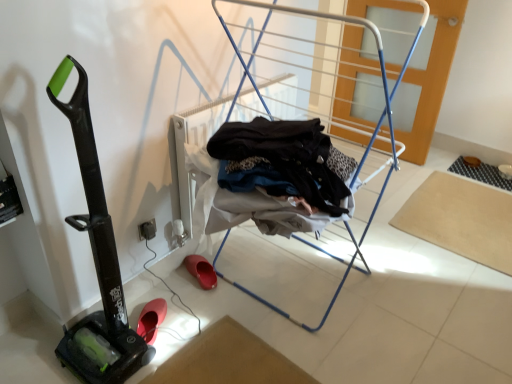
The image size is (512, 384). What do you see at coordinates (461, 219) in the screenshot?
I see `beige fabric yoga mat at lower right` at bounding box center [461, 219].

At what (x,y) coordinates should I click in order to perform the action: click on black plastic electric outlet at lower center. Please return your answer as a coordinate pair (x, y). Looking at the image, I should click on (147, 230).

Is black rubber vacuum at left bigger or smaller than rubber/matte clog at lower left, which is the first footwear in right-to-left order?

Clearly, black rubber vacuum at left is larger in size than rubber/matte clog at lower left, which is the first footwear in right-to-left order.

Can you confirm if black rubber vacuum at left is positioned to the right of rubber/matte clog at lower left, arranged as the 2th footwear when ordered from the bottom?

No, black rubber vacuum at left is not to the right of rubber/matte clog at lower left, arranged as the 2th footwear when ordered from the bottom.

Would you consider black rubber vacuum at left to be distant from rubber/matte clog at lower left, which is the first footwear in right-to-left order?

No, black rubber vacuum at left is not far from rubber/matte clog at lower left, which is the first footwear in right-to-left order.

Based on the photo, is rubber/soft sole shoe at lower left, marked as the 1th footwear in a front-to-back arrangement, positioned with its back to beige fabric yoga mat at lower right?

rubber/soft sole shoe at lower left, marked as the 1th footwear in a front-to-back arrangement, does not have its back to beige fabric yoga mat at lower right.

Considering the positions of objects rubber/soft sole shoe at lower left, marked as the 1th footwear in a front-to-back arrangement, and beige fabric yoga mat at lower right in the image provided, who is more to the right, rubber/soft sole shoe at lower left, marked as the 1th footwear in a front-to-back arrangement, or beige fabric yoga mat at lower right?

beige fabric yoga mat at lower right is more to the right.

Which is in front, point (142, 331) or point (442, 172)?

The point (142, 331) is closer to the camera.

Considering the sizes of objects rubber/soft sole shoe at lower left, the second footwear when ordered from right to left, and beige fabric yoga mat at lower right in the image provided, who is shorter, rubber/soft sole shoe at lower left, the second footwear when ordered from right to left, or beige fabric yoga mat at lower right?

beige fabric yoga mat at lower right.

Is point (213, 271) positioned behind point (145, 234)?

That is True.

From the image's perspective, is rubber/matte clog at lower left, the 1th footwear when ordered from top to bottom, located above black plastic electric outlet at lower center?

Incorrect, from the image's perspective, rubber/matte clog at lower left, the 1th footwear when ordered from top to bottom, is lower than black plastic electric outlet at lower center.

Could you tell me if rubber/matte clog at lower left, arranged as the 2th footwear when ordered from the bottom, is facing black plastic electric outlet at lower center?

No.

Which object is closer to the camera taking this photo, rubber/matte clog at lower left, which is the first footwear in right-to-left order, or black plastic electric outlet at lower center?

black plastic electric outlet at lower center is in front.

Considering the sizes of objects black rubber vacuum at left and beige fabric yoga mat at lower right in the image provided, who is shorter, black rubber vacuum at left or beige fabric yoga mat at lower right?

beige fabric yoga mat at lower right.

Is beige fabric yoga mat at lower right surrounded by black rubber vacuum at left?

No, beige fabric yoga mat at lower right is not inside black rubber vacuum at left.

How many degrees apart are the facing directions of black rubber vacuum at left and beige fabric yoga mat at lower right?

black rubber vacuum at left and beige fabric yoga mat at lower right are facing 90.9 degrees away from each other.

Is black rubber vacuum at left to the left of beige fabric yoga mat at lower right from the viewer's perspective?

Correct, you'll find black rubber vacuum at left to the left of beige fabric yoga mat at lower right.

Do you think rubber/matte clog at lower left, which is the first footwear in right-to-left order, is within metallic blue drying rack at center, or outside of it?

The correct answer is: inside.

Is rubber/matte clog at lower left, which is the first footwear in right-to-left order, positioned behind metallic blue drying rack at center?

Yes, rubber/matte clog at lower left, which is the first footwear in right-to-left order, is further from the viewer.

From the picture: Between rubber/matte clog at lower left, which is the 2th footwear from front to back, and metallic blue drying rack at center, which one has larger size?

With larger size is metallic blue drying rack at center.

Can you see metallic blue drying rack at center touching black rubber vacuum at left?

metallic blue drying rack at center and black rubber vacuum at left are not in contact.

Looking at this image, who is taller, metallic blue drying rack at center or black rubber vacuum at left?

Standing taller between the two is metallic blue drying rack at center.

From a real-world perspective, which object stands above the other?

metallic blue drying rack at center.

You are a GUI agent. You are given a task and a screenshot of the screen. Output one action in this format:
    pyautogui.click(x=<x>, y=<y>)
    Task: Click on the furniture behind the black rubber vacuum at left
    Image resolution: width=512 pixels, height=384 pixels.
    Given the screenshot: What is the action you would take?
    pyautogui.click(x=321, y=251)

Considering the relative positions of metallic blue drying rack at center and rubber/soft sole shoe at lower left, which appears as the second footwear when viewed from the back, in the image provided, is metallic blue drying rack at center behind rubber/soft sole shoe at lower left, which appears as the second footwear when viewed from the back,?

No, it is not.

From a real-world perspective, between metallic blue drying rack at center and rubber/soft sole shoe at lower left, which is the first footwear from left to right, who is vertically lower?

rubber/soft sole shoe at lower left, which is the first footwear from left to right.

How much distance is there between metallic blue drying rack at center and rubber/soft sole shoe at lower left, marked as the 1th footwear in a front-to-back arrangement?

The distance of metallic blue drying rack at center from rubber/soft sole shoe at lower left, marked as the 1th footwear in a front-to-back arrangement, is 1.04 meters.

Which is farther, (292,9) or (150,343)?

The point (150,343) is more distant.

Locate an element on the screen. Image resolution: width=512 pixels, height=384 pixels. vacuum that appears on the left of rubber/matte clog at lower left, the 2th footwear viewed from the left is located at coordinates (96, 258).

You are a GUI agent. You are given a task and a screenshot of the screen. Output one action in this format:
    pyautogui.click(x=<x>, y=<y>)
    Task: Click on the yoga mat below the rubber/soft sole shoe at lower left, the second footwear when ordered from right to left (from a real-world perspective)
    The width and height of the screenshot is (512, 384).
    Given the screenshot: What is the action you would take?
    pyautogui.click(x=461, y=219)

Estimate the real-world distances between objects in this image. Which object is further from black plastic electric outlet at lower center, black rubber vacuum at left or beige fabric yoga mat at lower right?

Based on the image, beige fabric yoga mat at lower right appears to be further to black plastic electric outlet at lower center.

When comparing their distances from metallic blue drying rack at center, does rubber/soft sole shoe at lower left, the second footwear when ordered from right to left, or beige fabric yoga mat at lower right seem closer?

beige fabric yoga mat at lower right lies closer to metallic blue drying rack at center than the other object.

From the image, which object appears to be nearer to black plastic electric outlet at lower center, black rubber vacuum at left or metallic blue drying rack at center?

Among the two, black rubber vacuum at left is located nearer to black plastic electric outlet at lower center.

Estimate the real-world distances between objects in this image. Which object is further from metallic blue drying rack at center, rubber/soft sole shoe at lower left, the second footwear when ordered from right to left, or black plastic electric outlet at lower center?

The object further to metallic blue drying rack at center is rubber/soft sole shoe at lower left, the second footwear when ordered from right to left.

Estimate the real-world distances between objects in this image. Which object is further from rubber/soft sole shoe at lower left, marked as the 1th footwear in a front-to-back arrangement, metallic blue drying rack at center or black rubber vacuum at left?

metallic blue drying rack at center is positioned further to the anchor rubber/soft sole shoe at lower left, marked as the 1th footwear in a front-to-back arrangement.

From the image, which object appears to be nearer to black plastic electric outlet at lower center, rubber/matte clog at lower left, the 1th footwear when ordered from top to bottom, or metallic blue drying rack at center?

rubber/matte clog at lower left, the 1th footwear when ordered from top to bottom.

Estimate the real-world distances between objects in this image. Which object is closer to rubber/matte clog at lower left, the 2th footwear viewed from the left, rubber/soft sole shoe at lower left, which ranks as the first footwear in bottom-to-top order, or beige fabric yoga mat at lower right?

rubber/soft sole shoe at lower left, which ranks as the first footwear in bottom-to-top order, is closer to rubber/matte clog at lower left, the 2th footwear viewed from the left.

Which object lies nearer to the anchor point black plastic electric outlet at lower center, rubber/matte clog at lower left, the 2th footwear viewed from the left, or black rubber vacuum at left?

rubber/matte clog at lower left, the 2th footwear viewed from the left, lies closer to black plastic electric outlet at lower center than the other object.

Where is `furniture located between black rubber vacuum at left and rubber/soft sole shoe at lower left, which appears as the second footwear when viewed from the back, in the depth direction`? The image size is (512, 384). furniture located between black rubber vacuum at left and rubber/soft sole shoe at lower left, which appears as the second footwear when viewed from the back, in the depth direction is located at coordinates (321, 251).

Where is `footwear between black plastic electric outlet at lower center and rubber/soft sole shoe at lower left, which appears as the second footwear when viewed from the back, from top to bottom`? footwear between black plastic electric outlet at lower center and rubber/soft sole shoe at lower left, which appears as the second footwear when viewed from the back, from top to bottom is located at coordinates (201, 271).

I want to click on furniture situated between rubber/matte clog at lower left, the 2th footwear viewed from the left, and beige fabric yoga mat at lower right from left to right, so coord(321,251).

Find the location of a particular element. The image size is (512, 384). furniture located between black rubber vacuum at left and rubber/matte clog at lower left, arranged as the 2th footwear when ordered from the bottom, in the depth direction is located at coordinates (321, 251).